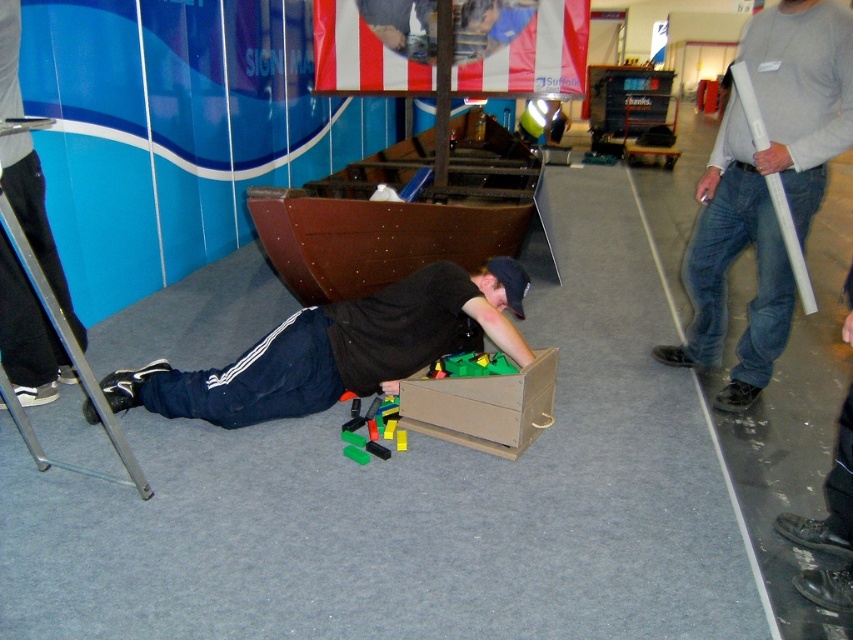
You are a participant at the exhibition and see the brown cardboard box at center and the green plastic blocks at center. Which object is taller?

The brown cardboard box at center is taller than the green plastic blocks at center.